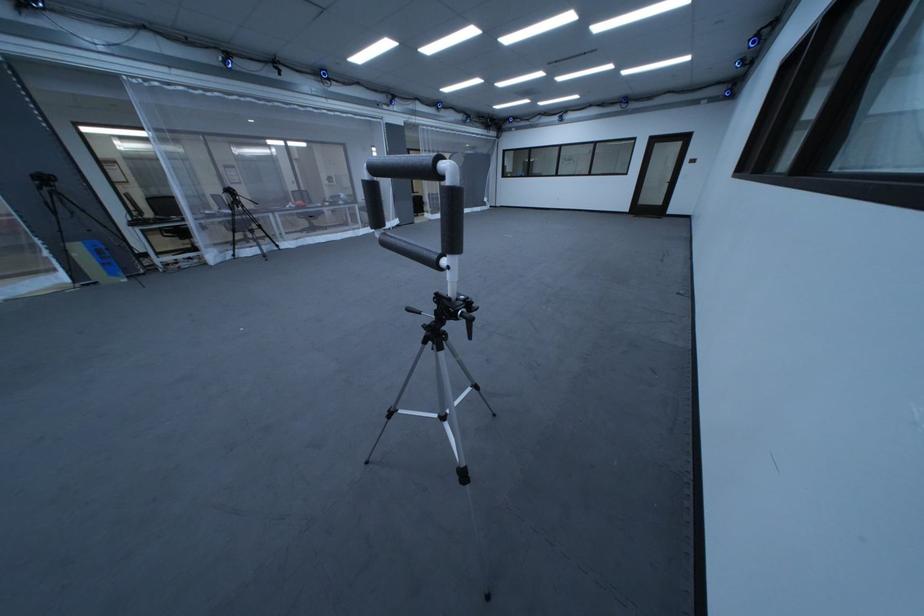
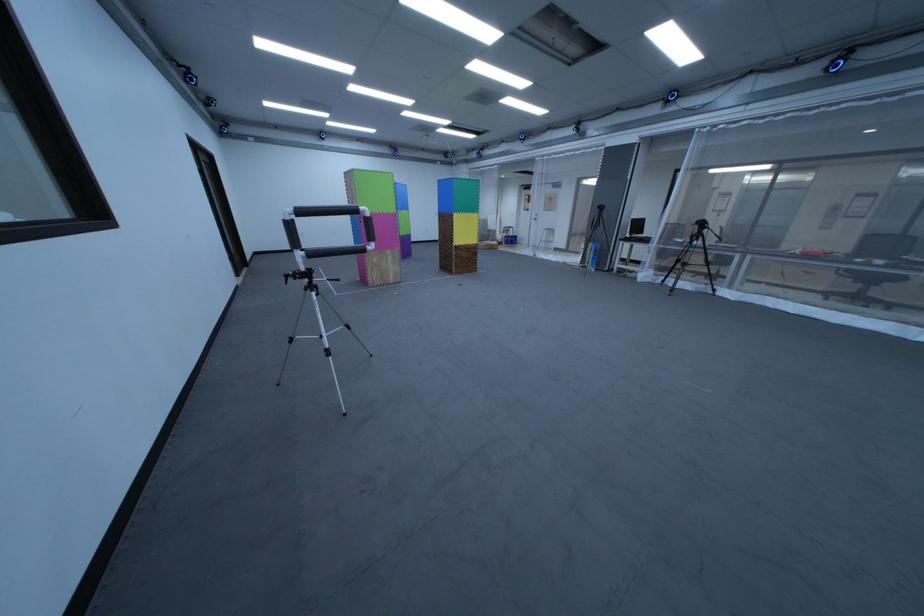
Find the pixel in the second image that matches the point at 120,228 in the first image.

(623, 238)